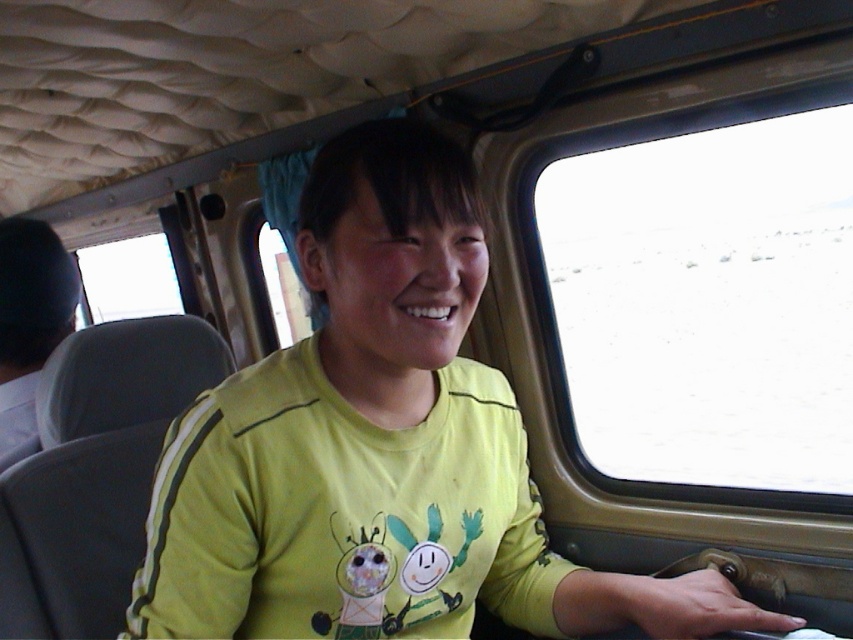
Question: Which point appears closest to the camera in this image?

Choices:
 (A) (555, 371)
 (B) (265, 227)

Answer: (A)

Question: Is transparent glass window at upper left to the right of transparent glass window at center from the viewer's perspective?

Choices:
 (A) no
 (B) yes

Answer: (A)

Question: Which object is farther from the camera taking this photo?

Choices:
 (A) transparent glass window at right
 (B) transparent glass window at center
 (C) yellow fabric shirt at center

Answer: (A)

Question: Is transparent glass window at right below transparent glass window at upper left?

Choices:
 (A) no
 (B) yes

Answer: (B)

Question: Considering the real-world distances, which object is closest to the transparent glass window at upper left?

Choices:
 (A) transparent glass window at right
 (B) transparent glass window at center
 (C) yellow fabric shirt at center

Answer: (B)

Question: Does transparent glass window at upper left have a larger size compared to transparent glass window at center?

Choices:
 (A) no
 (B) yes

Answer: (B)